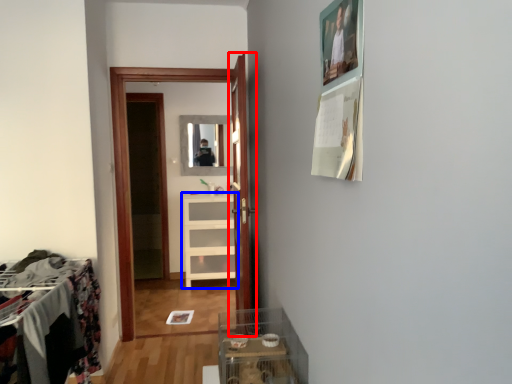
Question: Which of the following is the closest to the observer, door (highlighted by a red box) or cabinetry (highlighted by a blue box)?

Choices:
 (A) door
 (B) cabinetry

Answer: (A)